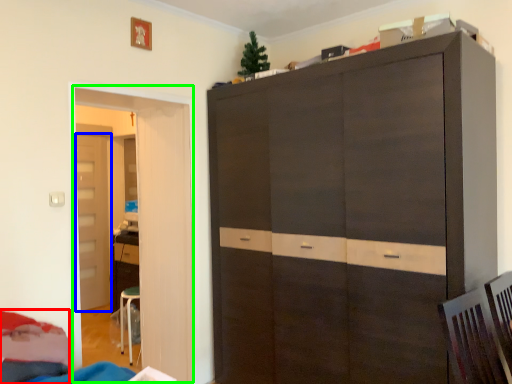
Question: Which object is the farthest from bed (highlighted by a red box)? Choose among these: door (highlighted by a blue box) or door (highlighted by a green box).

Choices:
 (A) door
 (B) door

Answer: (A)